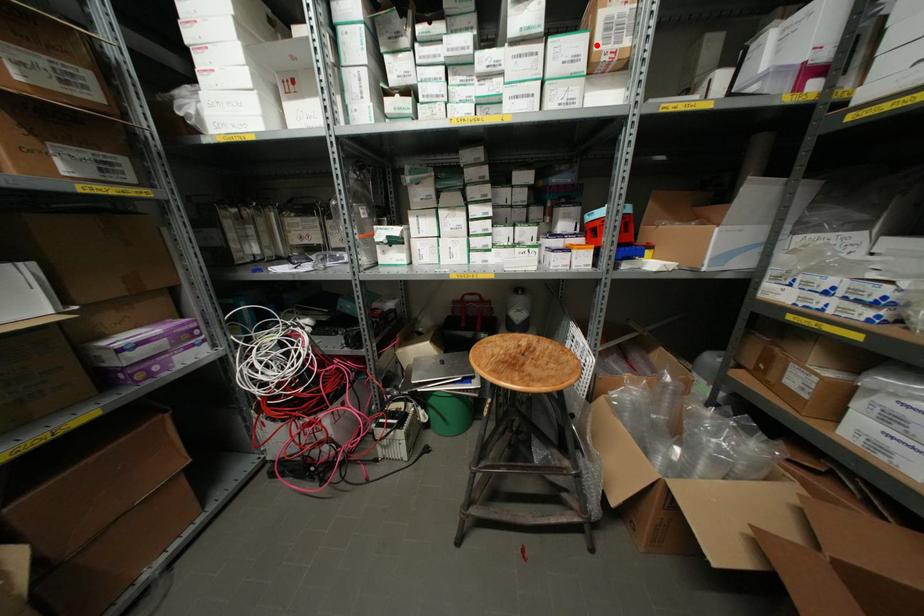
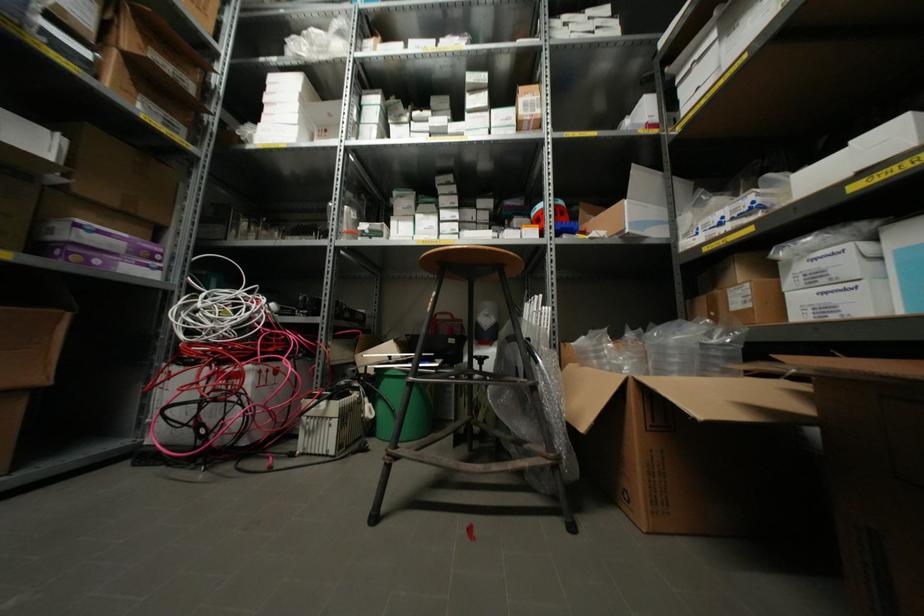
Locate, in the second image, the point that corresponds to the highlighted location in the first image.

(519, 111)